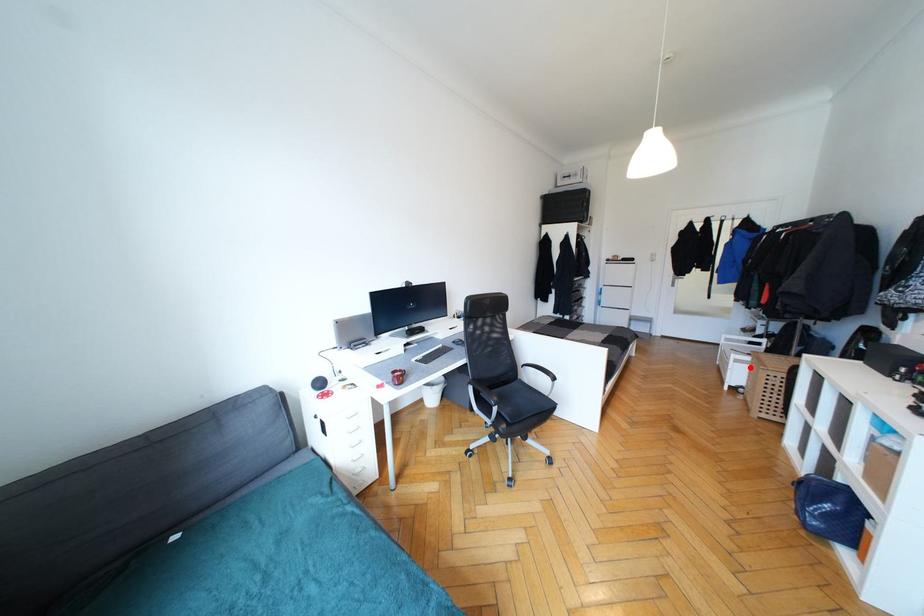
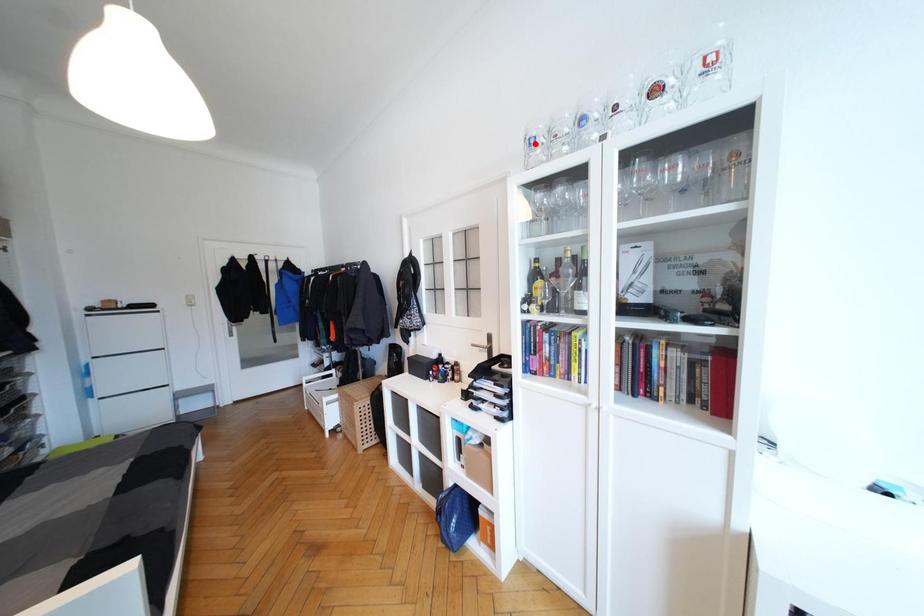
I am providing you with two images of the same scene from different viewpoints. A red point is marked on the first image and another point is marked on the second image. Does the point marked in image1 correspond to the same location as the one in image2?

No